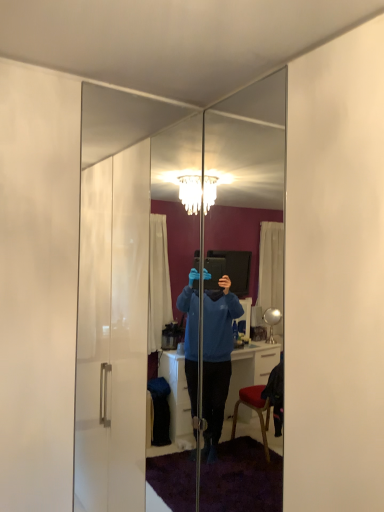
Question: Which direction should I rotate to face clear glass mirror at center, arranged as the second mirror when viewed from the left, — up or down?

Choices:
 (A) down
 (B) up

Answer: (A)

Question: Should I look upward or downward to see clear glass mirror at center, the 1th mirror in the left-to-right sequence?

Choices:
 (A) up
 (B) down

Answer: (B)

Question: Is clear glass mirror at center, the second mirror in the right-to-left sequence, to the right of clear glass mirror at center, arranged as the second mirror when viewed from the left, from the viewer's perspective?

Choices:
 (A) no
 (B) yes

Answer: (A)

Question: From a real-world perspective, is clear glass mirror at center, the 1th mirror in the left-to-right sequence, beneath clear glass mirror at center, arranged as the second mirror when viewed from the left?

Choices:
 (A) yes
 (B) no

Answer: (B)

Question: Can you confirm if clear glass mirror at center, the 1th mirror in the left-to-right sequence, is taller than clear glass mirror at center, the first mirror viewed from the right?

Choices:
 (A) yes
 (B) no

Answer: (A)

Question: Does clear glass mirror at center, the 1th mirror in the left-to-right sequence, come behind clear glass mirror at center, the first mirror viewed from the right?

Choices:
 (A) yes
 (B) no

Answer: (A)

Question: Can you confirm if clear glass mirror at center, the second mirror in the right-to-left sequence, is positioned to the left of clear glass mirror at center, arranged as the second mirror when viewed from the left?

Choices:
 (A) yes
 (B) no

Answer: (A)

Question: Is clear glass mirror at center, the second mirror in the right-to-left sequence, directly adjacent to clear glass mirror at center, the first mirror viewed from the right?

Choices:
 (A) no
 (B) yes

Answer: (A)

Question: Does clear glass mirror at center, arranged as the second mirror when viewed from the left, appear on the right side of clear glass mirror at center, the 1th mirror in the left-to-right sequence?

Choices:
 (A) yes
 (B) no

Answer: (A)

Question: Could clear glass mirror at center, the second mirror in the right-to-left sequence, be considered to be inside clear glass mirror at center, the first mirror viewed from the right?

Choices:
 (A) no
 (B) yes

Answer: (A)

Question: From the image's perspective, is clear glass mirror at center, arranged as the second mirror when viewed from the left, over clear glass mirror at center, the 1th mirror in the left-to-right sequence?

Choices:
 (A) yes
 (B) no

Answer: (B)

Question: Can you confirm if clear glass mirror at center, the first mirror viewed from the right, is wider than clear glass mirror at center, the 1th mirror in the left-to-right sequence?

Choices:
 (A) no
 (B) yes

Answer: (B)

Question: From the image's perspective, would you say clear glass mirror at center, arranged as the second mirror when viewed from the left, is shown under clear glass mirror at center, the 1th mirror in the left-to-right sequence?

Choices:
 (A) no
 (B) yes

Answer: (B)

Question: Looking at their shapes, would you say clear glass mirror at center, the 1th mirror in the left-to-right sequence, is wider or thinner than clear glass mirror at center, arranged as the second mirror when viewed from the left?

Choices:
 (A) wide
 (B) thin

Answer: (B)